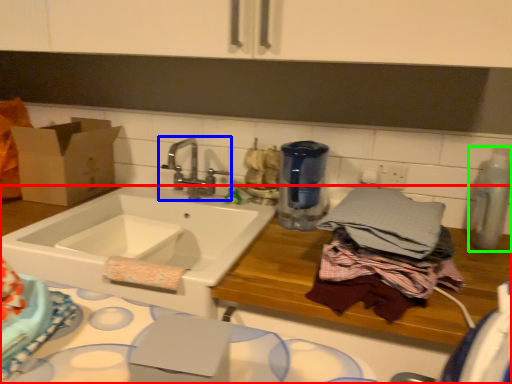
Question: Which object is positioned farthest from counter (highlighted by a red box)? Select from tap (highlighted by a blue box) and appliance (highlighted by a green box).

Choices:
 (A) tap
 (B) appliance

Answer: (A)